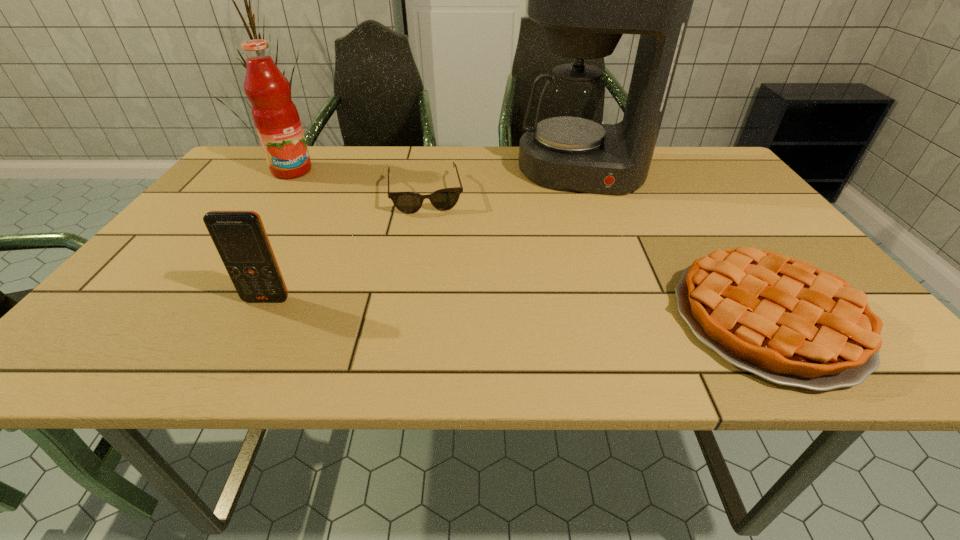
Find the location of a particular element. Image resolution: width=960 pixels, height=540 pixels. vacant space at the far right corner is located at coordinates (727, 180).

Locate an element on the screen. The height and width of the screenshot is (540, 960). vacant space that is in between the third object from right to left and the pie is located at coordinates pos(596,256).

Where is `empty location between the third object from right to left and the second object from left to right`? This screenshot has width=960, height=540. empty location between the third object from right to left and the second object from left to right is located at coordinates (346, 246).

What are the coordinates of `vacant space that is in between the coffee maker and the leftmost object` in the screenshot? It's located at (437, 171).

At what (x,y) coordinates should I click in order to perform the action: click on vacant point located between the fourth object from right to left and the pie. Please return your answer as a coordinate pair (x, y). The height and width of the screenshot is (540, 960). Looking at the image, I should click on (517, 309).

This screenshot has width=960, height=540. In order to click on free space between the tallest object and the pie in this screenshot , I will do `click(675, 245)`.

This screenshot has height=540, width=960. Find the location of `free space between the pie and the cellular telephone`. free space between the pie and the cellular telephone is located at coordinates (517, 309).

The image size is (960, 540). Find the location of `empty location between the third object from right to left and the tallest object`. empty location between the third object from right to left and the tallest object is located at coordinates (503, 182).

Find the location of a particular element. vacant point located between the third object from right to left and the fourth shortest object is located at coordinates (358, 182).

Locate an element on the screen. Image resolution: width=960 pixels, height=540 pixels. free space between the tallest object and the fruit juice is located at coordinates (437, 171).